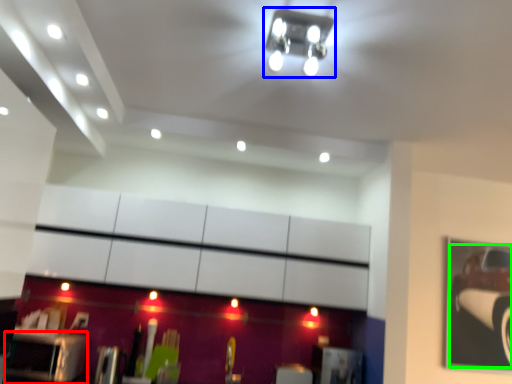
Question: Which object is positioned farthest from furniture (highlighted by a red box)? Select from light fixture (highlighted by a blue box) and car (highlighted by a green box).

Choices:
 (A) light fixture
 (B) car

Answer: (B)